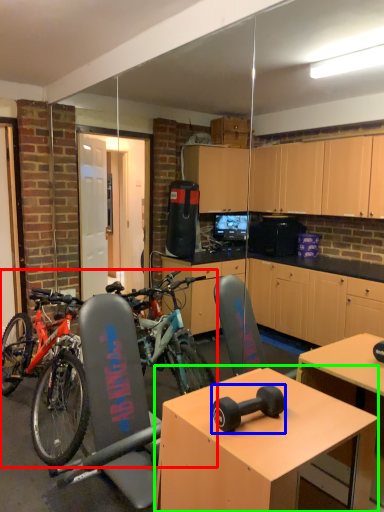
Question: Based on their relative distances, which object is nearer to bicycle (highlighted by a red box)? Choose from dumbbell (highlighted by a blue box) and desk (highlighted by a green box).

Choices:
 (A) dumbbell
 (B) desk

Answer: (B)